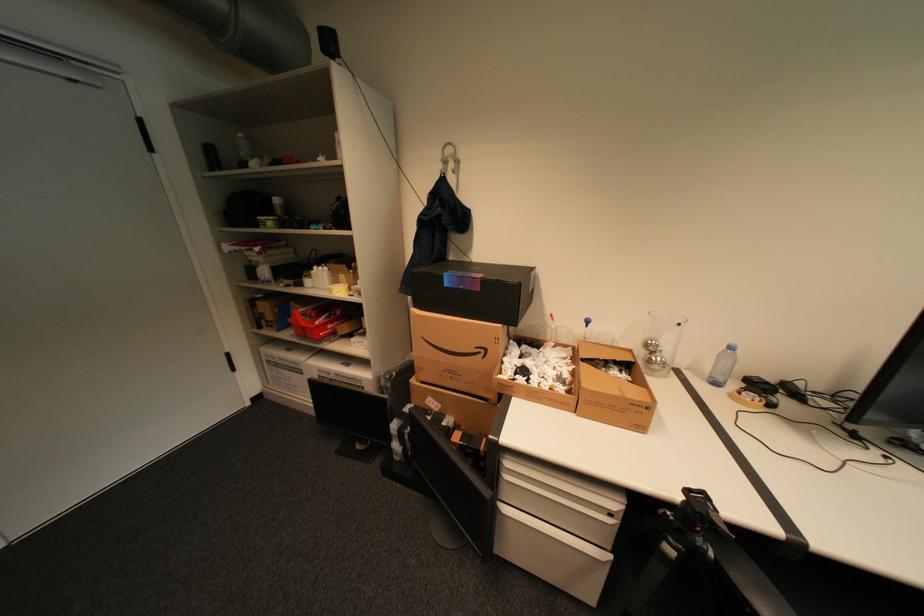
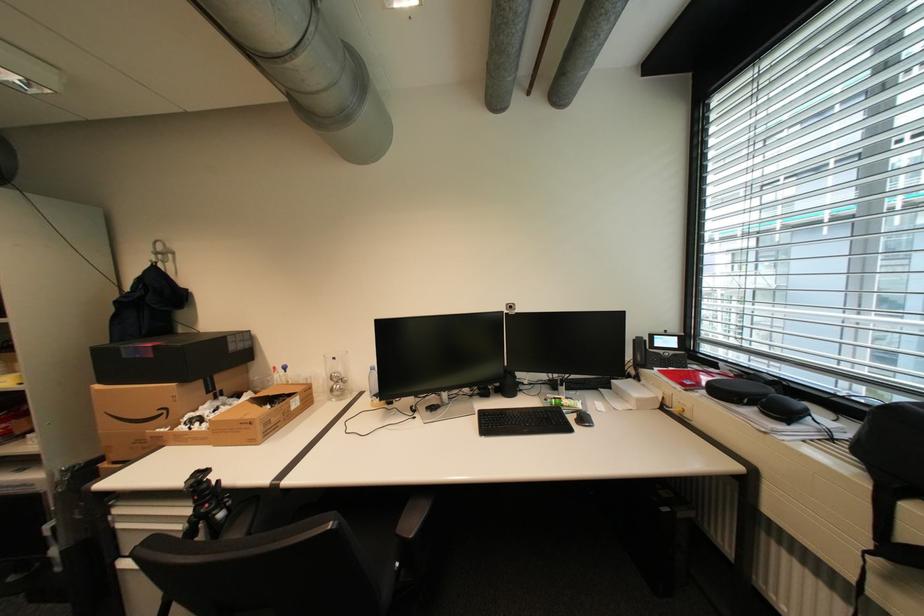
Where in the second image is the point corresponding to pixel 660 344 from the first image?

(343, 376)